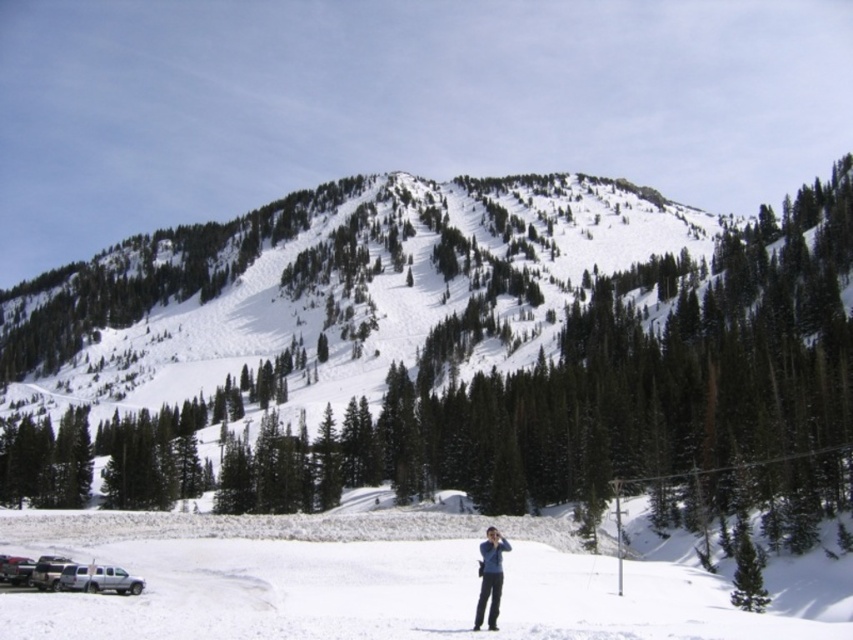
Question: Which object appears closest to the camera in this image?

Choices:
 (A) white snow ski slope at lower center
 (B) blue fabric jacket at lower center

Answer: (A)

Question: Which point is farther from the camera taking this photo?

Choices:
 (A) (494, 628)
 (B) (585, 616)

Answer: (B)

Question: Among these points, which one is farthest from the camera?

Choices:
 (A) (570, 600)
 (B) (502, 579)

Answer: (A)

Question: Is white snow ski slope at lower center to the right of blue fabric jacket at lower center from the viewer's perspective?

Choices:
 (A) no
 (B) yes

Answer: (A)

Question: Does white snow ski slope at lower center have a greater width compared to blue fabric jacket at lower center?

Choices:
 (A) no
 (B) yes

Answer: (B)

Question: Is white snow ski slope at lower center to the left of blue fabric jacket at lower center from the viewer's perspective?

Choices:
 (A) no
 (B) yes

Answer: (B)